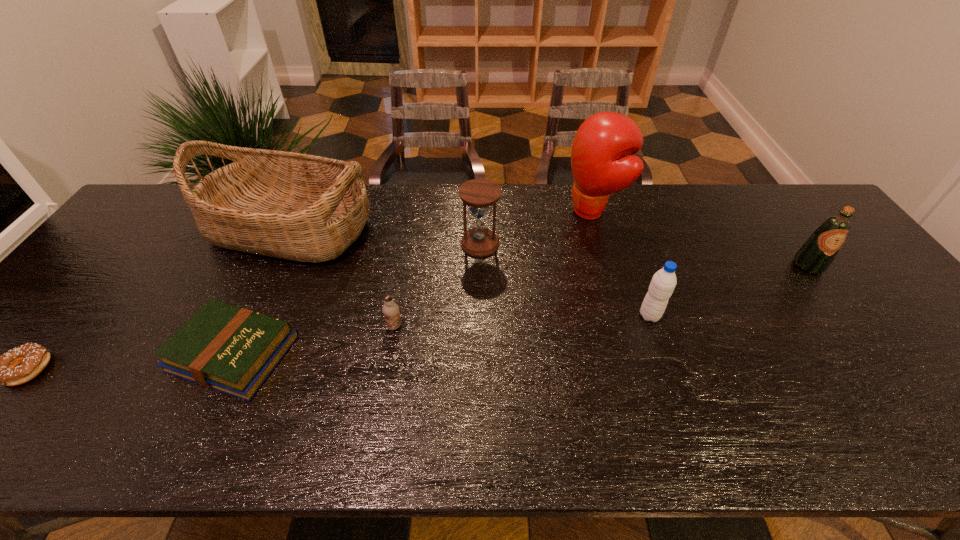
I want to click on boxing glove, so click(598, 167).

In order to click on the seventh shortest object in this screenshot , I will do `click(300, 207)`.

Find the location of a particular element. olive oil is located at coordinates (815, 256).

At what (x,y) coordinates should I click in order to perform the action: click on hourglass. Please return your answer as a coordinate pair (x, y). This screenshot has height=540, width=960. Looking at the image, I should click on (479, 194).

Image resolution: width=960 pixels, height=540 pixels. Find the location of `water bottle`. water bottle is located at coordinates (662, 285).

Identify the location of the fourth object from left to right. This screenshot has height=540, width=960. (390, 309).

Where is `chocolate milk`? chocolate milk is located at coordinates (390, 309).

Identify the location of book. (224, 347).

Identify the location of vacant region located on the striking surface of the tallest object. This screenshot has height=540, width=960. (476, 211).

At what (x,y) coordinates should I click in order to perform the action: click on vacant region located on the striking surface of the tallest object. Please return your answer as a coordinate pair (x, y). This screenshot has height=540, width=960. Looking at the image, I should click on (520, 211).